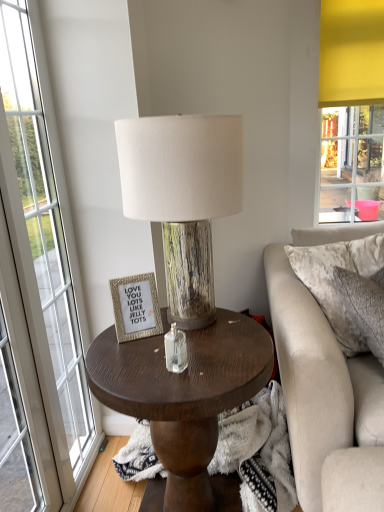
Question: Can you confirm if dark wood coffee table at center is wider than wood grain lampshade at center?

Choices:
 (A) yes
 (B) no

Answer: (A)

Question: Considering the relative positions of dark wood coffee table at center and wood grain lampshade at center in the image provided, is dark wood coffee table at center behind wood grain lampshade at center?

Choices:
 (A) yes
 (B) no

Answer: (B)

Question: From the image's perspective, is dark wood coffee table at center on top of wood grain lampshade at center?

Choices:
 (A) yes
 (B) no

Answer: (B)

Question: Is dark wood coffee table at center turned away from wood grain lampshade at center?

Choices:
 (A) no
 (B) yes

Answer: (A)

Question: From the image's perspective, is dark wood coffee table at center beneath wood grain lampshade at center?

Choices:
 (A) yes
 (B) no

Answer: (A)

Question: Could you tell me if dark wood coffee table at center is turned towards wood grain lampshade at center?

Choices:
 (A) no
 (B) yes

Answer: (A)

Question: From a real-world perspective, is transparent glass window at left physically below gold textured picture frame at upper center?

Choices:
 (A) no
 (B) yes

Answer: (A)

Question: Does transparent glass window at left have a greater height compared to gold textured picture frame at upper center?

Choices:
 (A) no
 (B) yes

Answer: (B)

Question: Is transparent glass window at left at the left side of gold textured picture frame at upper center?

Choices:
 (A) no
 (B) yes

Answer: (B)

Question: Considering the relative sizes of transparent glass window at left and gold textured picture frame at upper center in the image provided, is transparent glass window at left bigger than gold textured picture frame at upper center?

Choices:
 (A) yes
 (B) no

Answer: (A)

Question: Can you confirm if transparent glass window at left is shorter than gold textured picture frame at upper center?

Choices:
 (A) yes
 (B) no

Answer: (B)

Question: Could you tell me if transparent glass window at left is facing gold textured picture frame at upper center?

Choices:
 (A) no
 (B) yes

Answer: (B)

Question: Is velvet beige pillow at right oriented away from wood grain lampshade at center?

Choices:
 (A) no
 (B) yes

Answer: (A)